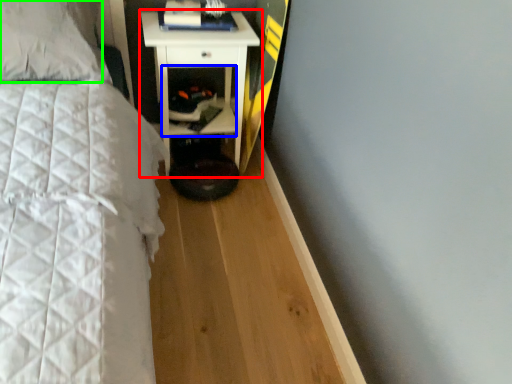
Question: Considering the real-world distances, which object is farthest from nightstand (highlighted by a red box)? cabinet (highlighted by a blue box) or pillow (highlighted by a green box)?

Choices:
 (A) cabinet
 (B) pillow

Answer: (B)